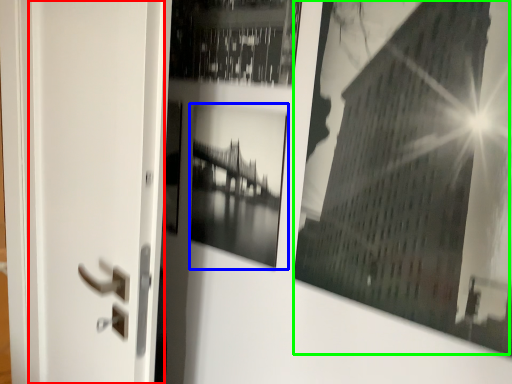
Question: Which object is the farthest from screen door (highlighted by a red box)? Choose among these: picture frame (highlighted by a blue box) or picture frame (highlighted by a green box).

Choices:
 (A) picture frame
 (B) picture frame

Answer: (B)